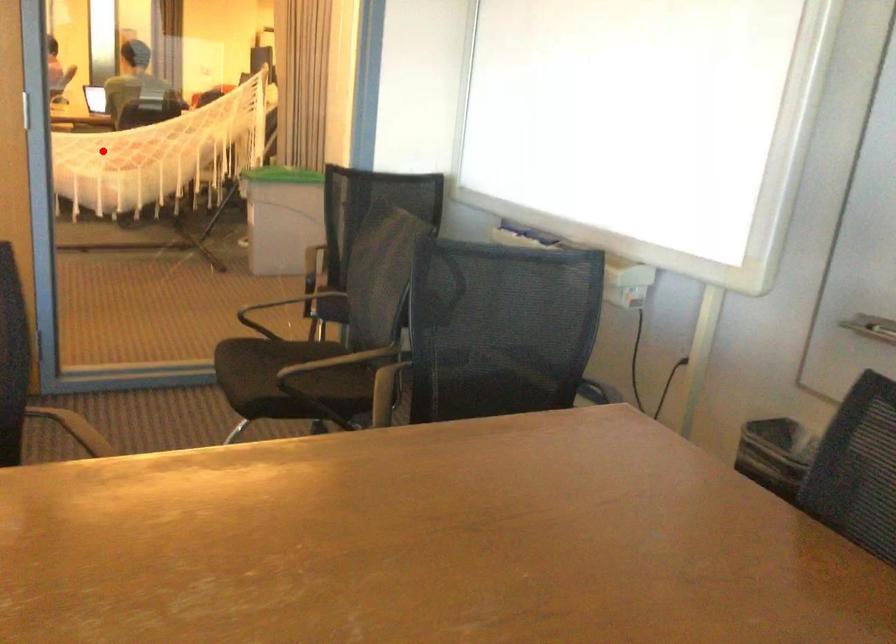
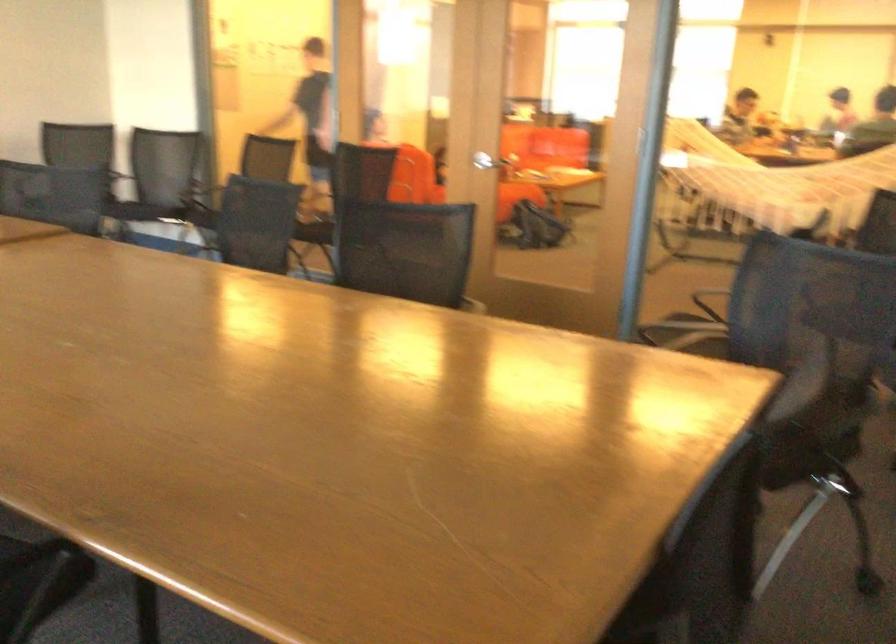
Where in the second image is the point corresponding to the highlighted location from the first image?

(778, 182)